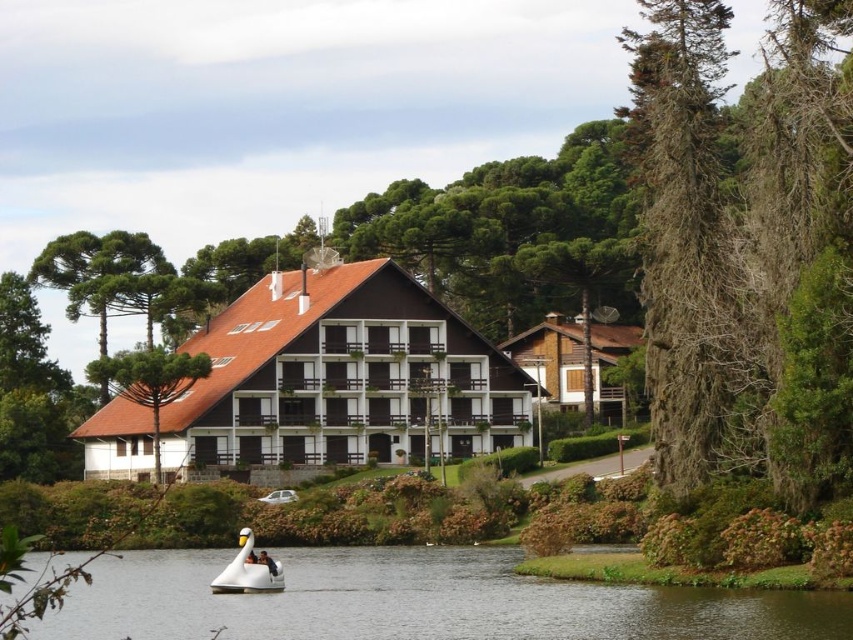
In the scene shown: You are standing on the dock and want to take a photo of the brown wood hotel at center and the white glossy water at lower center. Which object will appear narrower in the photo?

The brown wood hotel at center will appear narrower in the photo because it is thinner than the white glossy water at lower center.